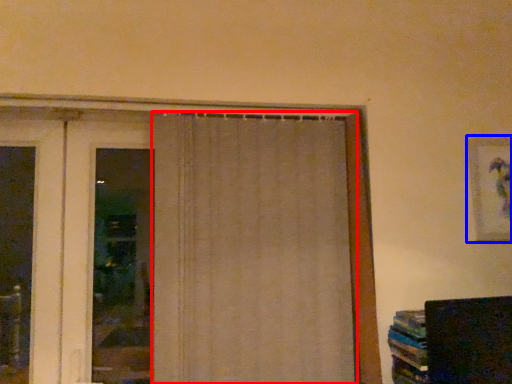
Question: Which object appears farthest to the camera in this image, curtain (highlighted by a red box) or picture frame (highlighted by a blue box)?

Choices:
 (A) curtain
 (B) picture frame

Answer: (B)